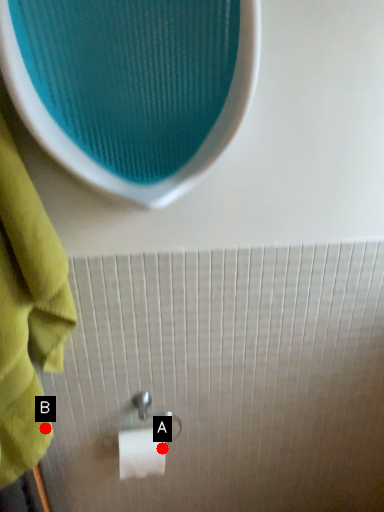
Question: Two points are circled on the image, labeled by A and B beside each circle. Among these points, which one is nearest to the camera?

Choices:
 (A) A is closer
 (B) B is closer

Answer: (B)